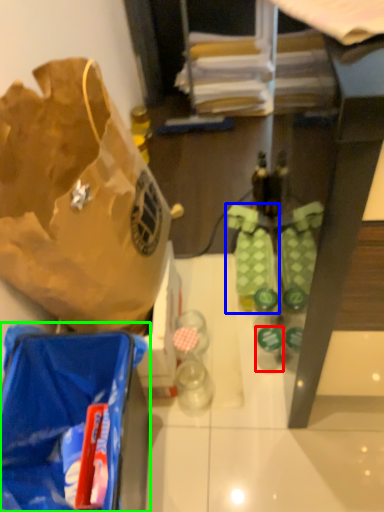
Question: Considering the real-world distances, which object is closest to bottle (highlighted by a red box)? footwear (highlighted by a blue box) or luggage and bags (highlighted by a green box).

Choices:
 (A) footwear
 (B) luggage and bags

Answer: (A)